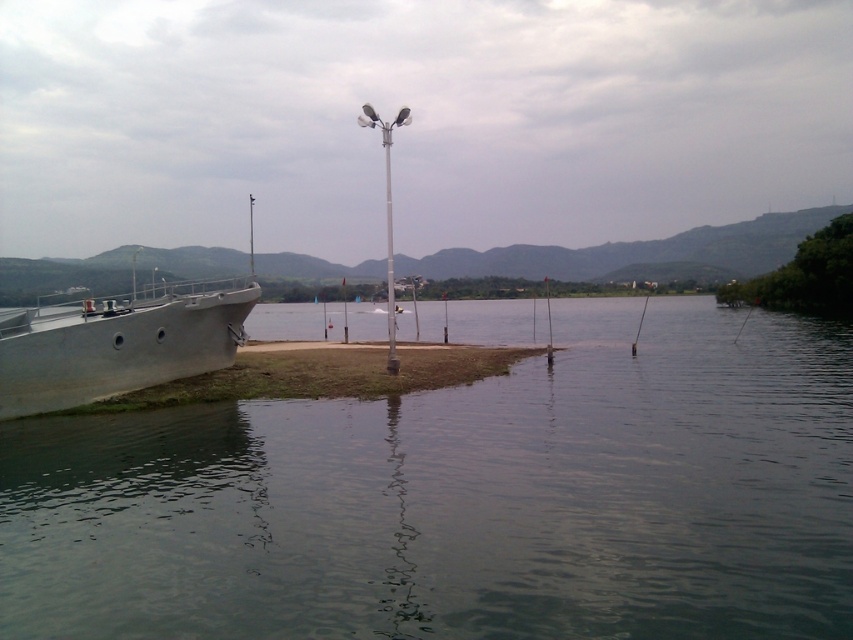
Who is more distant from viewer, (x=795, y=593) or (x=238, y=326)?

Positioned behind is point (x=238, y=326).

Looking at this image, is greenish water at lower left to the right of silver metallic boat at left from the viewer's perspective?

Yes, greenish water at lower left is to the right of silver metallic boat at left.

Does point (33, 483) lie behind point (180, 371)?

That is False.

Where is `greenish water at lower left`? greenish water at lower left is located at coordinates (463, 499).

Is point (242, 342) behind point (384, 141)?

Yes, it is behind point (384, 141).

Find the location of a particular element. The height and width of the screenshot is (640, 853). silver metallic boat at left is located at coordinates (115, 344).

What do you see at coordinates (463, 499) in the screenshot?
I see `greenish water at lower left` at bounding box center [463, 499].

Measure the distance between point (782, 547) and camera.

Point (782, 547) is 25.86 feet away from camera.

Describe the element at coordinates (463, 499) in the screenshot. I see `greenish water at lower left` at that location.

Image resolution: width=853 pixels, height=640 pixels. What are the coordinates of `greenish water at lower left` in the screenshot? It's located at (463, 499).